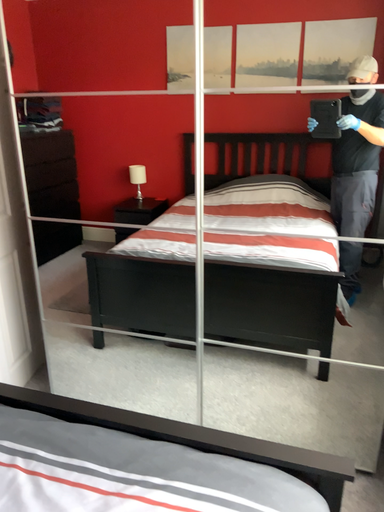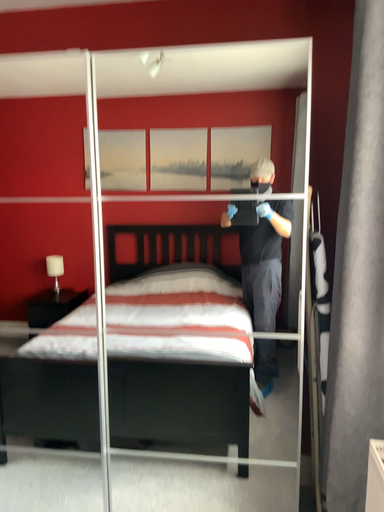
Question: How did the camera likely rotate when shooting the video?

Choices:
 (A) rotated upward
 (B) rotated downward

Answer: (A)